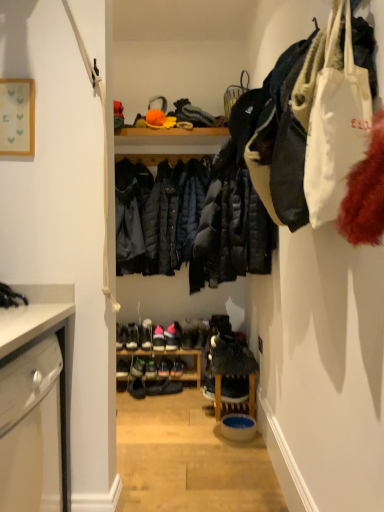
Question: In which direction should I rotate to look at shiny black sneakers at center, the 3th footwear positioned from the right?

Choices:
 (A) right
 (B) left

Answer: (B)

Question: Does matte black shoe at center, which ranks as the 3th footwear in left-to-right order, have a greater width compared to shiny black sneakers at center, the 3th footwear positioned from the right?

Choices:
 (A) yes
 (B) no

Answer: (B)

Question: Is matte black shoe at center, which ranks as the 3th footwear in left-to-right order, in contact with shiny black sneakers at center, the sixth footwear positioned from the left?

Choices:
 (A) yes
 (B) no

Answer: (A)

Question: Is shiny black sneakers at center, the 3th footwear positioned from the right, a part of matte black shoe at center, which ranks as the 3th footwear in left-to-right order?

Choices:
 (A) yes
 (B) no

Answer: (B)

Question: Does matte black shoe at center, which ranks as the 3th footwear in left-to-right order, have a smaller size compared to shiny black sneakers at center, the sixth footwear positioned from the left?

Choices:
 (A) no
 (B) yes

Answer: (B)

Question: Is matte black shoe at center, which ranks as the 3th footwear in left-to-right order, positioned before shiny black sneakers at center, the 3th footwear positioned from the right?

Choices:
 (A) no
 (B) yes

Answer: (B)

Question: Is matte black shoe at center, which ranks as the 3th footwear in left-to-right order, oriented towards shiny black sneakers at center, the 3th footwear positioned from the right?

Choices:
 (A) no
 (B) yes

Answer: (A)

Question: Is pink suede shoes at center, marked as the 8th footwear in a right-to-left arrangement, not inside black leather shoes at center, the fifth footwear in the right-to-left sequence?

Choices:
 (A) no
 (B) yes

Answer: (B)

Question: From a real-world perspective, is pink suede shoes at center, which appears as the 1th footwear when viewed from the left, beneath black leather shoes at center, the fifth footwear in the right-to-left sequence?

Choices:
 (A) no
 (B) yes

Answer: (A)

Question: Could you tell me if pink suede shoes at center, which appears as the 1th footwear when viewed from the left, is facing black leather shoes at center, acting as the fourth footwear starting from the left?

Choices:
 (A) yes
 (B) no

Answer: (B)

Question: Is black leather shoes at center, acting as the fourth footwear starting from the left, located within pink suede shoes at center, which appears as the 1th footwear when viewed from the left?

Choices:
 (A) no
 (B) yes

Answer: (A)

Question: Considering the relative sizes of pink suede shoes at center, which appears as the 1th footwear when viewed from the left, and black leather shoes at center, the fifth footwear in the right-to-left sequence, in the image provided, is pink suede shoes at center, which appears as the 1th footwear when viewed from the left, bigger than black leather shoes at center, the fifth footwear in the right-to-left sequence,?

Choices:
 (A) no
 (B) yes

Answer: (A)

Question: Does pink suede shoes at center, which appears as the 1th footwear when viewed from the left, have a smaller size compared to black leather shoes at center, the fifth footwear in the right-to-left sequence?

Choices:
 (A) no
 (B) yes

Answer: (B)

Question: Is shiny black shoe at center, which appears as the fourth footwear when viewed from the right, taller than shiny black shoe at center, the 7th footwear when ordered from left to right?

Choices:
 (A) no
 (B) yes

Answer: (A)